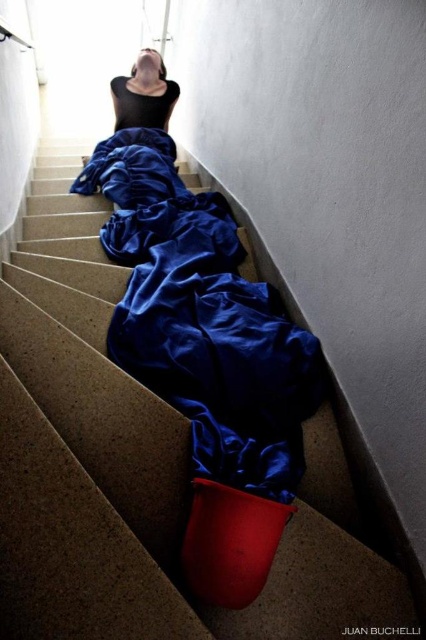
Question: Is black matte fabric at center smaller than blue satin robe at upper center?

Choices:
 (A) yes
 (B) no

Answer: (B)

Question: Which point is farther to the camera?

Choices:
 (A) blue satin robe at upper center
 (B) black matte fabric at center

Answer: (A)

Question: Which object is closer to the camera taking this photo?

Choices:
 (A) black matte fabric at center
 (B) blue satin robe at upper center

Answer: (A)

Question: Is black matte fabric at center to the right of blue satin robe at upper center from the viewer's perspective?

Choices:
 (A) yes
 (B) no

Answer: (B)

Question: Is black matte fabric at center closer to the viewer compared to blue satin robe at upper center?

Choices:
 (A) no
 (B) yes

Answer: (B)